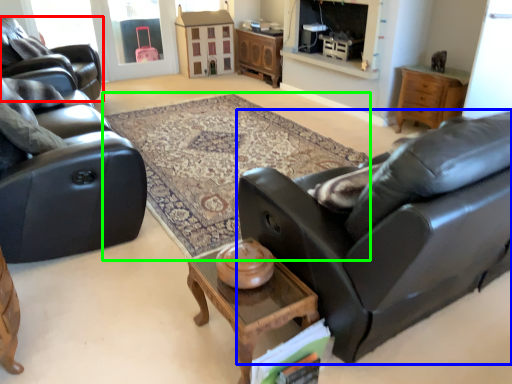
Question: Which object is the farthest from chair (highlighted by a red box)? Choose among these: studio couch (highlighted by a blue box) or plain (highlighted by a green box).

Choices:
 (A) studio couch
 (B) plain

Answer: (A)